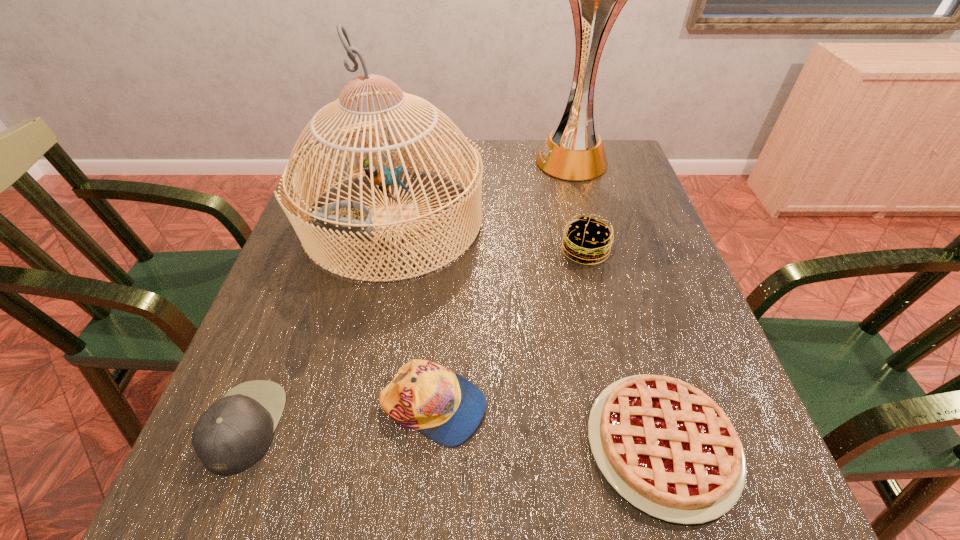
The width and height of the screenshot is (960, 540). Identify the location of vacant space located 0.380m on the back of the fourth shortest object. coord(561,153).

At what (x,y) coordinates should I click in order to perform the action: click on blank area located on the bill of the right cap. Please return your answer as a coordinate pair (x, y). The width and height of the screenshot is (960, 540). Looking at the image, I should click on (680, 407).

The image size is (960, 540). I want to click on vacant point located on the brim of the left cap, so click(388, 426).

Locate an element on the screen. vacant space situated on the left of the shortest object is located at coordinates (475, 444).

Identify the location of trophy located at the far edge. The height and width of the screenshot is (540, 960). (573, 151).

Where is `birdcage that is at the far edge`? birdcage that is at the far edge is located at coordinates (347, 218).

Where is `cap situated at the near edge`? This screenshot has width=960, height=540. cap situated at the near edge is located at coordinates (230, 436).

The image size is (960, 540). In order to click on pie situated at the near edge in this screenshot , I will do `click(666, 447)`.

Find the location of `birdcage present at the left edge`. birdcage present at the left edge is located at coordinates (347, 218).

At what (x,y) coordinates should I click in order to perform the action: click on cap that is at the left edge. Please return your answer as a coordinate pair (x, y). This screenshot has width=960, height=540. Looking at the image, I should click on (230, 436).